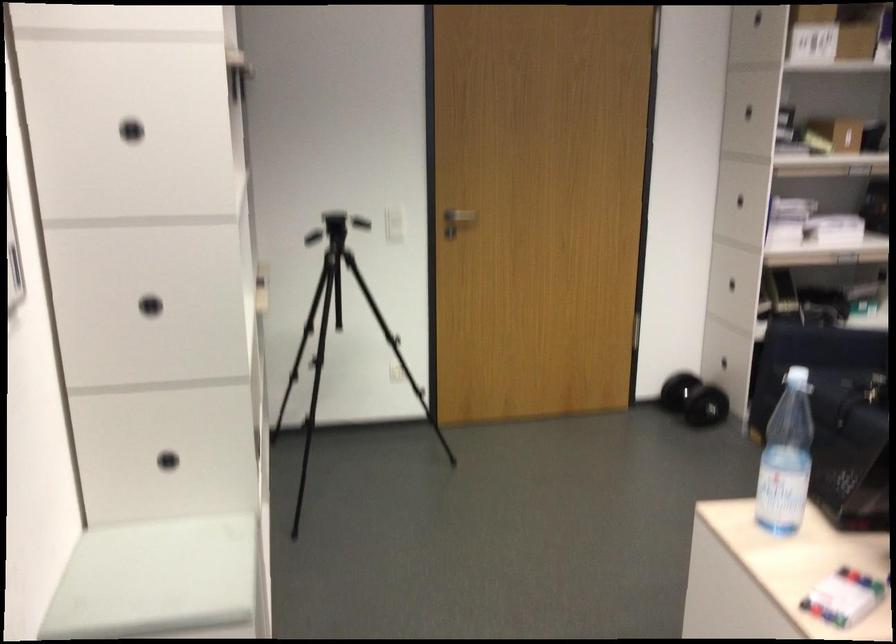
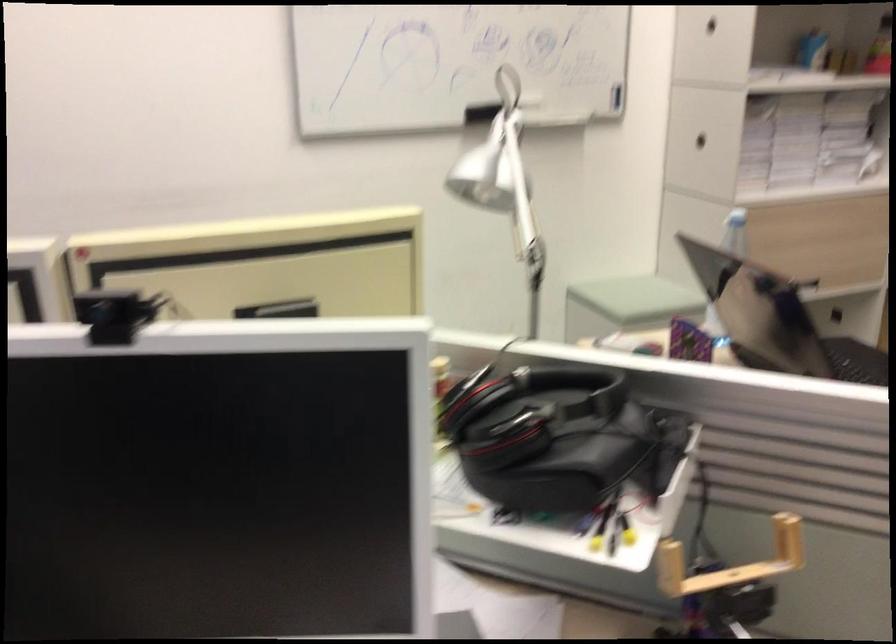
Question: I am providing you with two images of the same scene from different viewpoints. After the viewpoint changes to image2, which objects are now occluded?

Choices:
 (A) wooden U-shaped handle
 (B) black webcam
 (C) white chair lever
 (D) black cabinet handle

Answer: (D)